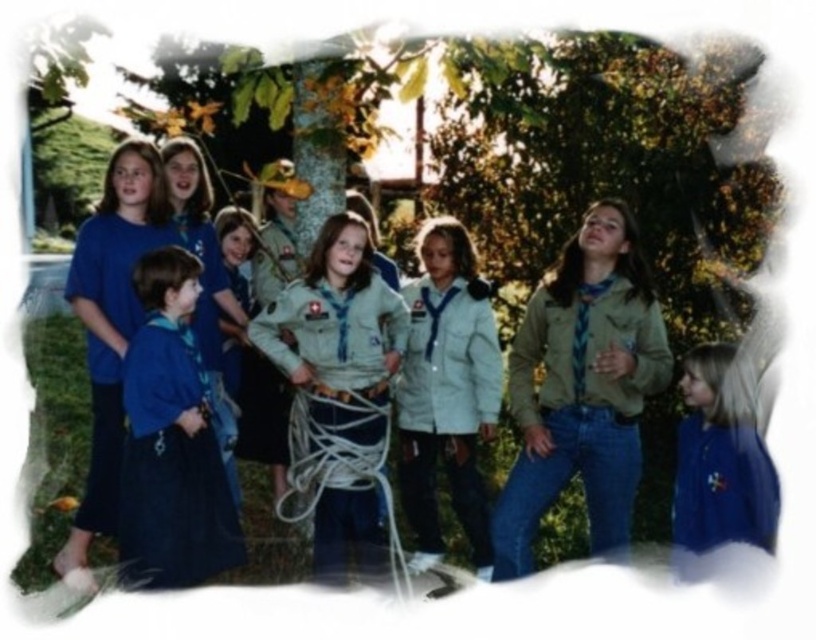
Between light beige fabric uniform at center and blue fabric shirt at left, which one is positioned higher?

blue fabric shirt at left is higher up.

Is point (358, 522) more distant than point (215, 323)?

No, it is not.

You are a GUI agent. You are given a task and a screenshot of the screen. Output one action in this format:
    pyautogui.click(x=<x>, y=<y>)
    Task: Click on the light beige fabric uniform at center
    
    Given the screenshot: What is the action you would take?
    pyautogui.click(x=338, y=403)

Measure the distance between point (318,400) and camera.

Point (318,400) is 5.44 meters from camera.

Identify the location of light beige fabric uniform at center. (338, 403).

What do you see at coordinates (446, 392) in the screenshot?
I see `light gray uniform at center` at bounding box center [446, 392].

Which of these two, light gray uniform at center or blue denim uniform at lower left, stands shorter?

blue denim uniform at lower left

Who is more distant from viewer, (402, 454) or (194, 497)?

The point (402, 454) is more distant.

The height and width of the screenshot is (640, 816). In order to click on light gray uniform at center in this screenshot , I will do point(446,392).